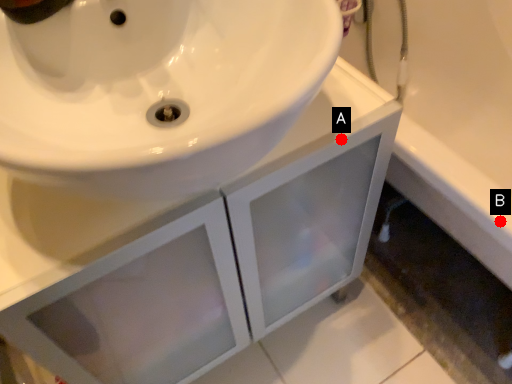
Question: Two points are circled on the image, labeled by A and B beside each circle. Which point is farther from the camera taking this photo?

Choices:
 (A) A is further
 (B) B is further

Answer: (B)